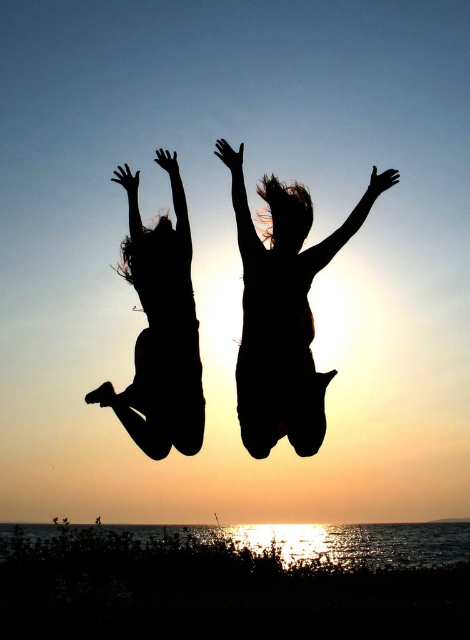
Who is more forward, (271, 365) or (180, 289)?

Positioned in front is point (271, 365).

Is the position of black matte silhouette at center more distant than that of black silhouette girl at left?

That is False.

Identify the location of black matte silhouette at center. (283, 312).

This screenshot has width=470, height=640. Identify the location of black matte silhouette at center. (283, 312).